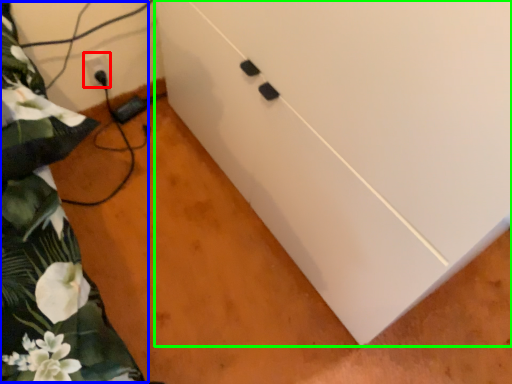
Question: Considering the real-world distances, which object is closest to electric outlet (highlighted by a red box)? bed (highlighted by a blue box) or cabinetry (highlighted by a green box).

Choices:
 (A) bed
 (B) cabinetry

Answer: (A)